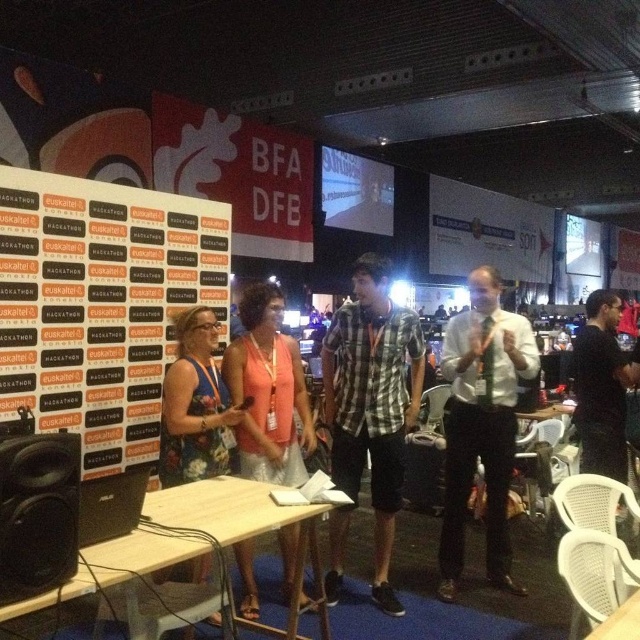
You are organizing a photo shoot and need to ensure that the orange fabric dress at center and the wooden table at center are both visible in the frame. Given their sizes, which object should you prioritize positioning closer to the camera to maintain clarity?

The orange fabric dress at center is bigger than the wooden table at center. To ensure both are visible and clear, prioritize positioning the wooden table at center closer to the camera since it is smaller and might need better focus to capture details.

You are an event organizer who needs to ensure that all orange fabric items are visible to attendees. Given the orange fabric banner at left and orange fabric dress at center, which one is taller?

The orange fabric banner at left is taller than the orange fabric dress at center.